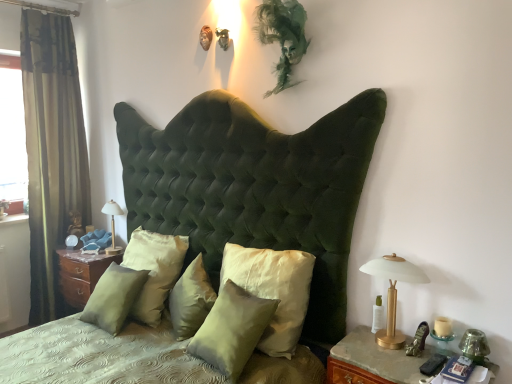
Question: Is satin green pillow at center, the 3th pillow from the right, directly adjacent to transparent glass window at left?

Choices:
 (A) no
 (B) yes

Answer: (A)

Question: Does satin green pillow at center, the 3th pillow positioned from the left, appear on the right side of transparent glass window at left?

Choices:
 (A) yes
 (B) no

Answer: (A)

Question: Does satin green pillow at center, the 3th pillow from the right, have a greater height compared to transparent glass window at left?

Choices:
 (A) yes
 (B) no

Answer: (B)

Question: Is satin green pillow at center, the 3th pillow positioned from the left, further to camera compared to transparent glass window at left?

Choices:
 (A) no
 (B) yes

Answer: (A)

Question: From the image's perspective, does satin green pillow at center, the 3th pillow positioned from the left, appear lower than transparent glass window at left?

Choices:
 (A) no
 (B) yes

Answer: (B)

Question: Is green velvet curtain at left to the left or to the right of wooden nightstand at lower right, positioned as the first nightstand in front-to-back order, in the image?

Choices:
 (A) right
 (B) left

Answer: (B)

Question: Considering their positions, is green velvet curtain at left located in front of or behind wooden nightstand at lower right, positioned as the first nightstand in front-to-back order?

Choices:
 (A) behind
 (B) front

Answer: (A)

Question: Do you think green velvet curtain at left is within wooden nightstand at lower right, positioned as the first nightstand in front-to-back order, or outside of it?

Choices:
 (A) inside
 (B) outside

Answer: (B)

Question: Is green velvet curtain at left taller or shorter than wooden nightstand at lower right, positioned as the first nightstand in front-to-back order?

Choices:
 (A) short
 (B) tall

Answer: (B)

Question: Is wooden nightstand at lower right, the 2th nightstand when ordered from back to front, wider or thinner than satin green pillow at center, the 5th pillow positioned from the right?

Choices:
 (A) wide
 (B) thin

Answer: (A)

Question: In terms of size, does wooden nightstand at lower right, which is the 1th nightstand in right-to-left order, appear bigger or smaller than satin green pillow at center, the 5th pillow positioned from the right?

Choices:
 (A) big
 (B) small

Answer: (A)

Question: From their relative heights in the image, would you say wooden nightstand at lower right, the 2th nightstand when ordered from back to front, is taller or shorter than satin green pillow at center, the 1th pillow positioned from the left?

Choices:
 (A) short
 (B) tall

Answer: (A)

Question: Relative to satin green pillow at center, the 1th pillow positioned from the left, is wooden nightstand at lower right, the 2th nightstand when ordered from back to front, in front or behind?

Choices:
 (A) front
 (B) behind

Answer: (A)

Question: In the image, is transparent glass window at left positioned in front of or behind green velvet curtain at left?

Choices:
 (A) front
 (B) behind

Answer: (B)

Question: From a real-world perspective, is transparent glass window at left physically located above or below green velvet curtain at left?

Choices:
 (A) above
 (B) below

Answer: (A)